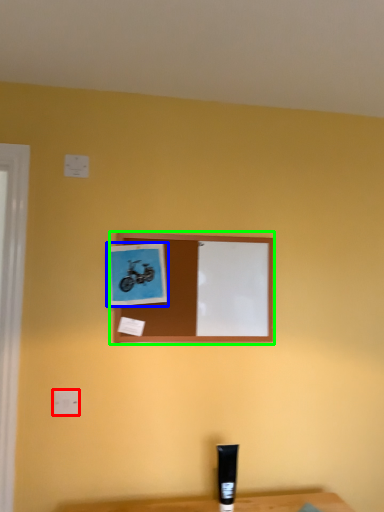
Question: Based on their relative distances, which object is farther from electric outlet (highlighted by a red box)? Choose from picture frame (highlighted by a blue box) and picture frame (highlighted by a green box).

Choices:
 (A) picture frame
 (B) picture frame

Answer: (B)